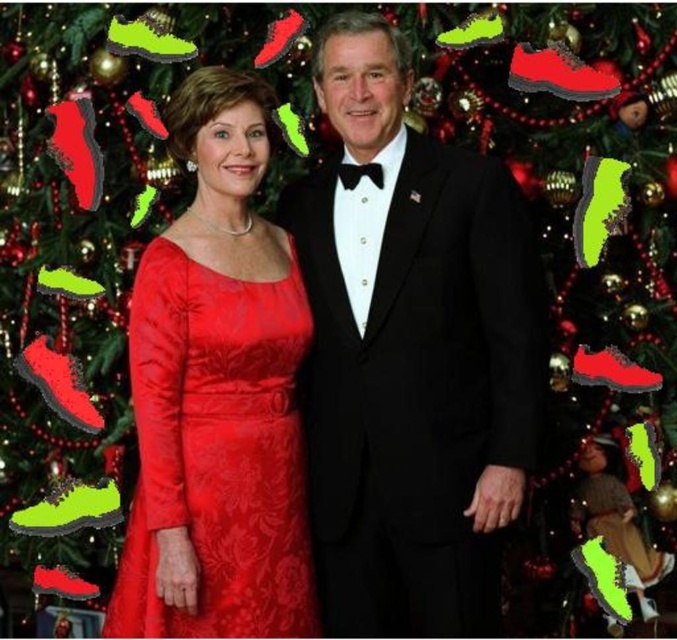
Does point (439, 166) come behind point (269, 381)?

That is False.

Is the position of black satin suit at center less distant than that of matte velvet dress at center?

No, black satin suit at center is behind matte velvet dress at center.

Who is more distant from viewer, (x=414, y=582) or (x=204, y=422)?

Point (x=414, y=582)

Find the location of a particular element. black satin suit at center is located at coordinates 410,353.